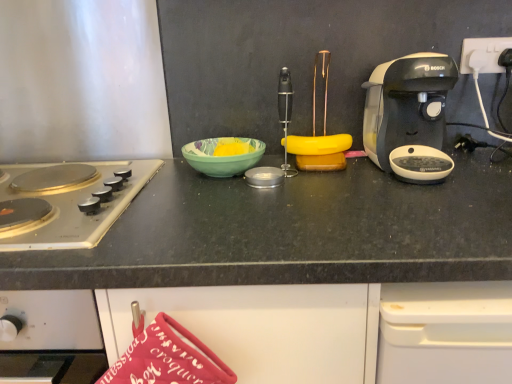
Locate an element on the screen. This screenshot has height=384, width=512. silver/golden metallic gas stove at left is located at coordinates (66, 202).

Describe the element at coordinates (222, 156) in the screenshot. I see `green glossy bowl at center` at that location.

What do you see at coordinates (483, 54) in the screenshot? I see `white plastic power outlet at upper right` at bounding box center [483, 54].

Find the location of `silver/golden metallic gas stove at left`. silver/golden metallic gas stove at left is located at coordinates (66, 202).

From the image's perspective, which one is positioned lower, silver/golden metallic gas stove at left or green glossy bowl at center?

silver/golden metallic gas stove at left appears lower in the image.

Between silver/golden metallic gas stove at left and green glossy bowl at center, which one has larger width?

With larger width is silver/golden metallic gas stove at left.

Between silver/golden metallic gas stove at left and green glossy bowl at center, which one has more height?

silver/golden metallic gas stove at left is taller.

Which is nearer, (133, 197) or (246, 139)?

Point (133, 197) appears to be closer to the viewer than point (246, 139).

From the picture: Is green glossy bowl at center inside or outside of silver/golden metallic gas stove at left?

green glossy bowl at center cannot be found inside silver/golden metallic gas stove at left.

Can you tell me how much green glossy bowl at center and silver/golden metallic gas stove at left differ in facing direction?

green glossy bowl at center and silver/golden metallic gas stove at left are facing 0.00167 degrees away from each other.

Is green glossy bowl at center taller or shorter than silver/golden metallic gas stove at left?

green glossy bowl at center is shorter than silver/golden metallic gas stove at left.

Do you think silver/golden metallic gas stove at left is within white plastic power outlet at upper right, or outside of it?

silver/golden metallic gas stove at left is not enclosed by white plastic power outlet at upper right.

From a real-world perspective, relative to white plastic power outlet at upper right, is silver/golden metallic gas stove at left vertically above or below?

In terms of real-world spatial position, silver/golden metallic gas stove at left is below white plastic power outlet at upper right.

Locate an element on the screen. gas stove that appears in front of the white plastic power outlet at upper right is located at coordinates (66, 202).

Which object is wider, silver/golden metallic gas stove at left or white plastic power outlet at upper right?

Wider between the two is silver/golden metallic gas stove at left.

From a real-world perspective, who is located higher, black plastic coffee maker at right or green glossy bowl at center?

In real-world perspective, black plastic coffee maker at right is above.

Is black plastic coffee maker at right looking in the opposite direction of green glossy bowl at center?

black plastic coffee maker at right is not turned away from green glossy bowl at center.

Visually, is black plastic coffee maker at right positioned to the left or to the right of green glossy bowl at center?

black plastic coffee maker at right is positioned on green glossy bowl at center's right side.

From the image's perspective, is black plastic coffee maker at right under silver/golden metallic gas stove at left?

Actually, black plastic coffee maker at right appears above silver/golden metallic gas stove at left in the image.

Is black plastic coffee maker at right thinner than silver/golden metallic gas stove at left?

Correct, the width of black plastic coffee maker at right is less than that of silver/golden metallic gas stove at left.

Based on the photo, is black plastic coffee maker at right not within silver/golden metallic gas stove at left?

That's correct, black plastic coffee maker at right is outside of silver/golden metallic gas stove at left.

From a real-world perspective, between black plastic coffee maker at right and silver/golden metallic gas stove at left, who is vertically lower?

From a 3D spatial view, silver/golden metallic gas stove at left is below.

From the picture: From a real-world perspective, does white plastic power outlet at upper right stand above green glossy bowl at center?

Indeed, from a real-world perspective, white plastic power outlet at upper right stands above green glossy bowl at center.

Find the location of a particular element. power outlet that appears behind the green glossy bowl at center is located at coordinates 483,54.

From the picture: Is white plastic power outlet at upper right to the right of green glossy bowl at center from the viewer's perspective?

Yes.

In the scene shown: Which object is closer to the camera, white plastic power outlet at upper right or green glossy bowl at center?

green glossy bowl at center is more forward.

Is silver/golden metallic gas stove at left behind black plastic coffee maker at right?

No, silver/golden metallic gas stove at left is closer to the camera.

Considering the positions of objects silver/golden metallic gas stove at left and black plastic coffee maker at right in the image provided, who is more to the left, silver/golden metallic gas stove at left or black plastic coffee maker at right?

Positioned to the left is silver/golden metallic gas stove at left.

Could you tell me if silver/golden metallic gas stove at left is turned towards black plastic coffee maker at right?

No, silver/golden metallic gas stove at left does not turn towards black plastic coffee maker at right.

Can you confirm if silver/golden metallic gas stove at left is smaller than black plastic coffee maker at right?

Incorrect, silver/golden metallic gas stove at left is not smaller in size than black plastic coffee maker at right.

Where is `bowl on the right side of silver/golden metallic gas stove at left`? The height and width of the screenshot is (384, 512). bowl on the right side of silver/golden metallic gas stove at left is located at coordinates (222, 156).

Where is `bowl above the silver/golden metallic gas stove at left (from the image's perspective)`? This screenshot has width=512, height=384. bowl above the silver/golden metallic gas stove at left (from the image's perspective) is located at coordinates (222, 156).

Considering their positions, is white plastic power outlet at upper right positioned closer to silver/golden metallic gas stove at left than black plastic coffee maker at right?

black plastic coffee maker at right is positioned closer to the anchor silver/golden metallic gas stove at left.

Looking at the image, which one is located further to green glossy bowl at center, silver/golden metallic gas stove at left or black plastic coffee maker at right?

black plastic coffee maker at right.

Looking at this image, from the image, which object appears to be nearer to silver/golden metallic gas stove at left, black plastic coffee maker at right or white plastic power outlet at upper right?

The object closer to silver/golden metallic gas stove at left is black plastic coffee maker at right.

From the image, which object appears to be nearer to silver/golden metallic gas stove at left, white plastic power outlet at upper right or green glossy bowl at center?

The object closer to silver/golden metallic gas stove at left is green glossy bowl at center.

Based on their spatial positions, is black plastic coffee maker at right or green glossy bowl at center further from white plastic power outlet at upper right?

The object further to white plastic power outlet at upper right is green glossy bowl at center.

Based on their spatial positions, is silver/golden metallic gas stove at left or black plastic coffee maker at right closer to white plastic power outlet at upper right?

black plastic coffee maker at right is positioned closer to the anchor white plastic power outlet at upper right.

Considering their positions, is silver/golden metallic gas stove at left positioned further to black plastic coffee maker at right than white plastic power outlet at upper right?

Based on the image, silver/golden metallic gas stove at left appears to be further to black plastic coffee maker at right.

Based on their spatial positions, is green glossy bowl at center or white plastic power outlet at upper right closer to black plastic coffee maker at right?

white plastic power outlet at upper right is closer to black plastic coffee maker at right.

The height and width of the screenshot is (384, 512). Identify the location of bowl between silver/golden metallic gas stove at left and white plastic power outlet at upper right from left to right. pos(222,156).

Where is `coffee maker between green glossy bowl at center and white plastic power outlet at upper right in the horizontal direction`? Image resolution: width=512 pixels, height=384 pixels. coffee maker between green glossy bowl at center and white plastic power outlet at upper right in the horizontal direction is located at coordinates (406, 104).

Image resolution: width=512 pixels, height=384 pixels. I want to click on bowl between silver/golden metallic gas stove at left and black plastic coffee maker at right in the horizontal direction, so click(x=222, y=156).

You are a GUI agent. You are given a task and a screenshot of the screen. Output one action in this format:
    pyautogui.click(x=<x>, y=<y>)
    Task: Click on the coffee maker between silver/golden metallic gas stove at left and white plastic power outlet at upper right from left to right
    The height and width of the screenshot is (384, 512).
    Given the screenshot: What is the action you would take?
    pyautogui.click(x=406, y=104)